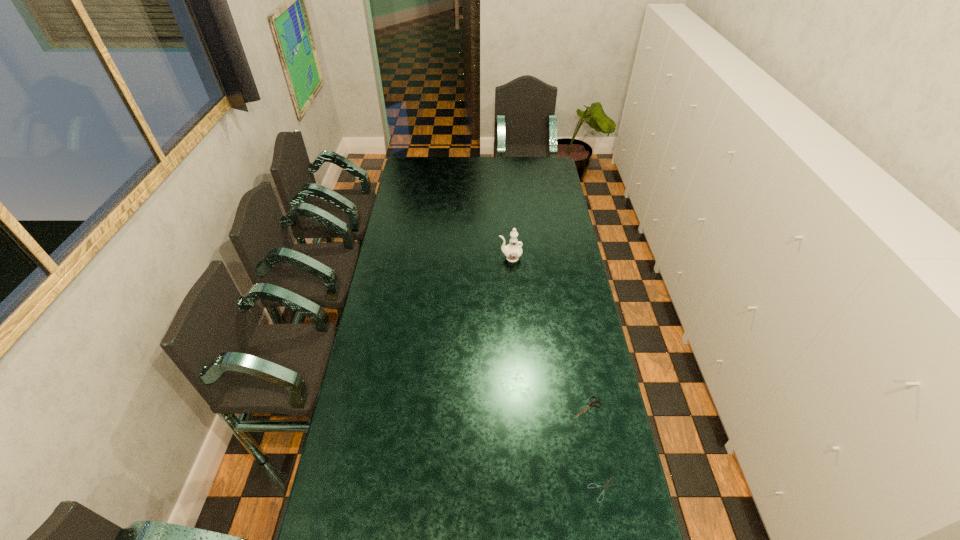
Where is `vacant area between the shortest object and the chinaware`? The image size is (960, 540). vacant area between the shortest object and the chinaware is located at coordinates (557, 374).

Locate an element on the screen. vacant space that is in between the tallest object and the second tallest object is located at coordinates [548, 333].

Locate an element on the screen. vacant area that lies between the shorter shears and the taller shears is located at coordinates (595, 448).

Find the location of a particular element. The height and width of the screenshot is (540, 960). vacant area that lies between the second nearest object and the shortest object is located at coordinates (595, 448).

The width and height of the screenshot is (960, 540). What are the coordinates of `object that ranks as the second closest to the shorter shears` in the screenshot? It's located at (512, 251).

Locate which object is the second closest to the second shortest object. Please provide its 2D coordinates. Your answer should be formatted as a tuple, i.e. [(x, y)], where the tuple contains the x and y coordinates of a point satisfying the conditions above.

[(512, 251)]

Locate an element on the screen. This screenshot has width=960, height=540. free space that satisfies the following two spatial constraints: 1. at the spout of the leftmost object; 2. on the right side of the nearest object is located at coordinates (526, 489).

Where is `vacant space that satisfies the following two spatial constraints: 1. on the back side of the nearer shears; 2. at the spout of the farthest object`? The height and width of the screenshot is (540, 960). vacant space that satisfies the following two spatial constraints: 1. on the back side of the nearer shears; 2. at the spout of the farthest object is located at coordinates (560, 258).

In order to click on free point that satisfies the following two spatial constraints: 1. at the spout of the shortest object; 2. on the left side of the chinaware in this screenshot , I will do `click(526, 489)`.

At what (x,y) coordinates should I click in order to perform the action: click on blank area in the image that satisfies the following two spatial constraints: 1. at the spout of the leftmost object; 2. on the right side of the farther shears. Please return your answer as a coordinate pair (x, y). This screenshot has width=960, height=540. Looking at the image, I should click on (520, 407).